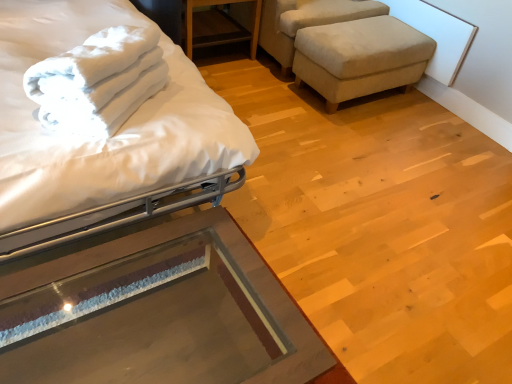
Question: Considering the positions of beige fabric swivel chair at upper right and transparent glass table at lower left, placed as the 2th table when sorted from top to bottom, in the image, is beige fabric swivel chair at upper right bigger or smaller than transparent glass table at lower left, placed as the 2th table when sorted from top to bottom,?

Choices:
 (A) big
 (B) small

Answer: (A)

Question: Is beige fabric swivel chair at upper right taller or shorter than transparent glass table at lower left, acting as the first table starting from the bottom?

Choices:
 (A) tall
 (B) short

Answer: (A)

Question: Considering the real-world distances, which object is closest to the white soft towel at upper left?

Choices:
 (A) transparent glass table at lower left, positioned as the second table in back-to-front order
 (B) white matte bed at left
 (C) beige fabric swivel chair at upper right
 (D) wooden table at upper center, the first table in the top-to-bottom sequence
 (E) beige fabric stool at right

Answer: (B)

Question: Considering the real-world distances, which object is farthest from the white soft towel at upper left?

Choices:
 (A) beige fabric swivel chair at upper right
 (B) white matte bed at left
 (C) wooden table at upper center, acting as the second table starting from the bottom
 (D) transparent glass table at lower left, placed as the 2th table when sorted from top to bottom
 (E) beige fabric stool at right

Answer: (A)